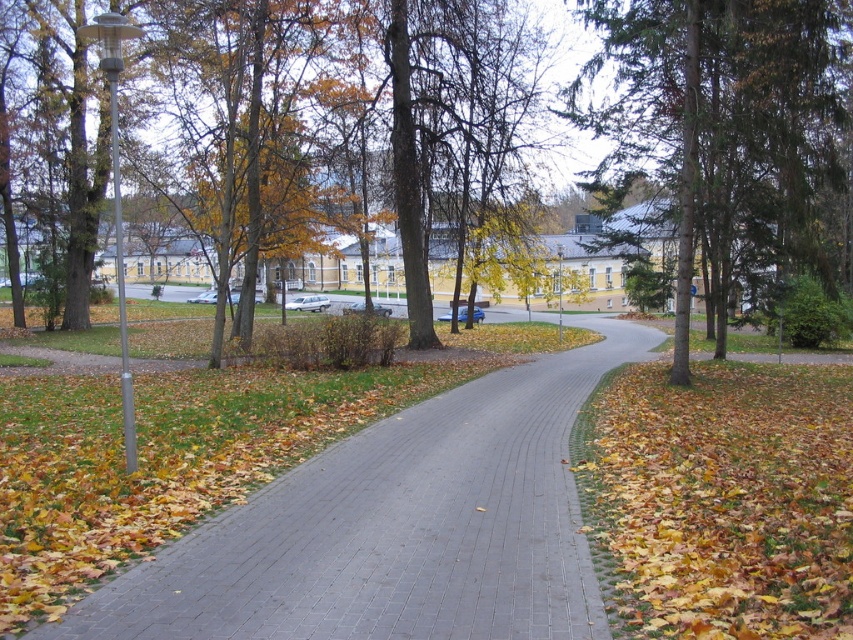
Question: In this image, where is yellow dry leaves at lower right located relative to green evergreen tree at upper right?

Choices:
 (A) left
 (B) right

Answer: (A)

Question: Considering the relative positions of gray brick pavement at center and yellow dry leaves at lower right in the image provided, where is gray brick pavement at center located with respect to yellow dry leaves at lower right?

Choices:
 (A) left
 (B) right

Answer: (A)

Question: Which of the following is the farthest from the observer?

Choices:
 (A) gray brick pavement at center
 (B) green evergreen tree at upper right

Answer: (B)

Question: Does gray brick pavement at center appear on the left side of green evergreen tree at upper right?

Choices:
 (A) no
 (B) yes

Answer: (B)

Question: Which object appears closest to the camera in this image?

Choices:
 (A) green evergreen tree at upper right
 (B) yellow dry leaves at lower right
 (C) gray brick pavement at center

Answer: (B)

Question: Which of the following is the farthest from the observer?

Choices:
 (A) yellow dry leaves at lower right
 (B) gray brick pavement at center

Answer: (B)